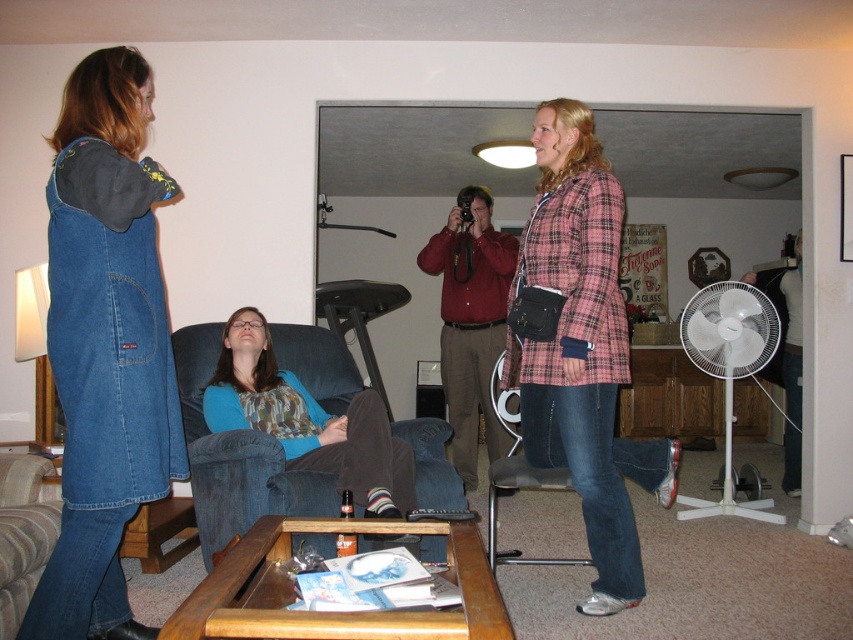
You are taking a photo of two points in the living room. The first point is at coordinate point (44, 488) and the second is at point (518, 417). Which point will appear larger in your photo?

Point (44, 488) is closer to the camera than point (518, 417), so it will appear larger in the photo.

You are trying to place a large potted plant between the brown fabric armchair at lower left and the denim fabric armchair at center. Based on their widths, which armchair should the plant be closer to?

The brown fabric armchair at lower left might be wider than the denim fabric armchair at center, so the plant should be placed closer to the denim fabric armchair at center to ensure enough space.